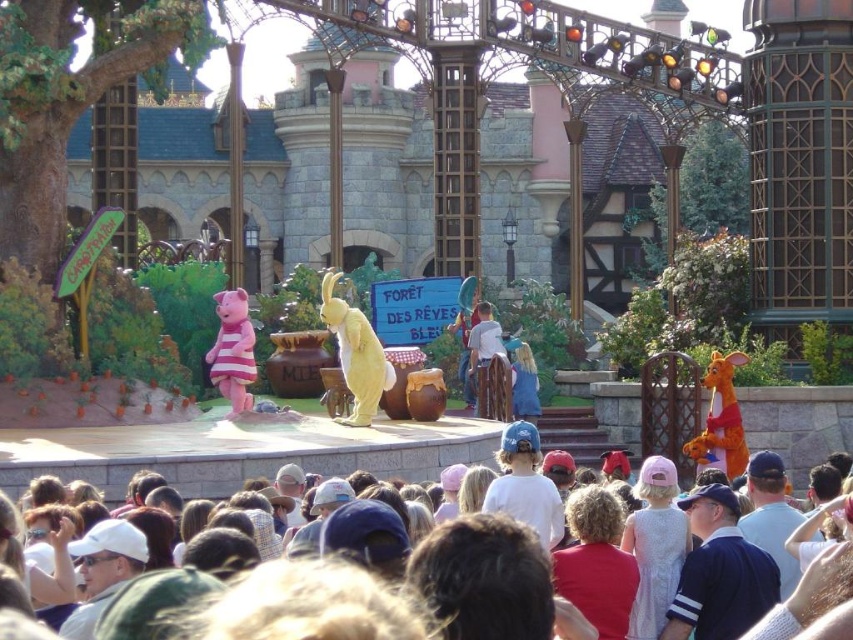
Question: Which point appears farthest from the camera in this image?

Choices:
 (A) (733, 438)
 (B) (292, 433)
 (C) (238, 406)
 (D) (364, 417)

Answer: (C)

Question: Is white cotton crowd at lower center above orange plush kangaroo at right?

Choices:
 (A) no
 (B) yes

Answer: (A)

Question: Is orange plush kangaroo at right closer to camera compared to pink fabric pig at center?

Choices:
 (A) no
 (B) yes

Answer: (A)

Question: Can you confirm if yellow plush rabbit at center is smaller than orange plush kangaroo at right?

Choices:
 (A) no
 (B) yes

Answer: (A)

Question: Among these objects, which one is nearest to the camera?

Choices:
 (A) white cotton crowd at lower center
 (B) orange plush kangaroo at right
 (C) yellow plush rabbit at center
 (D) pink fabric pig at center

Answer: (A)

Question: Which object appears farthest from the camera in this image?

Choices:
 (A) orange plush kangaroo at right
 (B) pink fabric pig at center
 (C) white cotton crowd at lower center
 (D) yellow plush rabbit at center

Answer: (A)